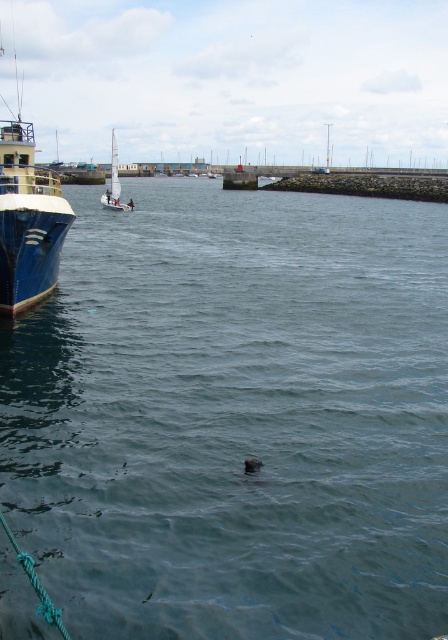
Does clear blue water at center appear on the right side of white sailboat at center?

Correct, you'll find clear blue water at center to the right of white sailboat at center.

Between clear blue water at center and white sailboat at center, which one has more height?

With more height is white sailboat at center.

Is point (421, 326) closer to viewer compared to point (113, 177)?

Yes, it is in front of point (113, 177).

Identify the location of clear blue water at center. (235, 417).

Is clear blue water at center further to camera compared to blue glossy boat at left?

No, clear blue water at center is closer to the viewer.

From the picture: Between clear blue water at center and blue glossy boat at left, which one has less height?

clear blue water at center

Measure the distance between clear blue water at center and camera.

clear blue water at center and camera are 5.20 meters apart from each other.

Locate an element on the screen. This screenshot has height=640, width=448. clear blue water at center is located at coordinates (235, 417).

In the scene shown: Is blue glossy boat at left below white sailboat at center?

No.

Between blue glossy boat at left and white sailboat at center, which one appears on the right side from the viewer's perspective?

white sailboat at center

Between point (31, 216) and point (117, 205), which one is positioned in front?

Point (31, 216) is in front.

Find the location of a particular element. This screenshot has height=640, width=448. blue glossy boat at left is located at coordinates (27, 218).